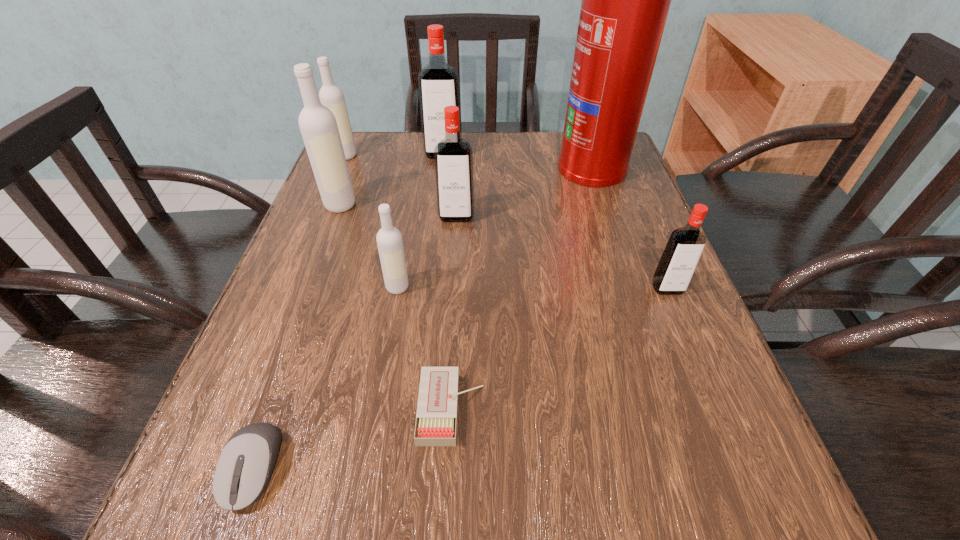
This screenshot has width=960, height=540. Identify the location of vacant region located on the back of the nearest white vodka. (418, 178).

Locate an element on the screen. Image resolution: width=960 pixels, height=540 pixels. vacant space situated on the front and back of the smallest red vodka is located at coordinates (761, 516).

Find the location of a particular element. The image size is (960, 540). vacant region located on the striking surface of the white matchbox is located at coordinates (533, 409).

The image size is (960, 540). I want to click on fire extinguisher located at the far edge, so click(x=625, y=2).

Locate an element on the screen. Image resolution: width=960 pixels, height=540 pixels. object located at the near edge is located at coordinates (244, 468).

Locate an element on the screen. computer equipment located in the left edge section of the desktop is located at coordinates (244, 468).

I want to click on fire extinguisher located at the right edge, so click(625, 2).

At what (x,y) coordinates should I click in order to perform the action: click on vodka present at the right edge. Please return your answer as a coordinate pair (x, y). Looking at the image, I should click on (683, 250).

Identify the location of object that is at the far left corner. Image resolution: width=960 pixels, height=540 pixels. (331, 96).

At what (x,y) coordinates should I click in order to perform the action: click on object located at the near left corner. Please return your answer as a coordinate pair (x, y). This screenshot has height=540, width=960. Looking at the image, I should click on (244, 468).